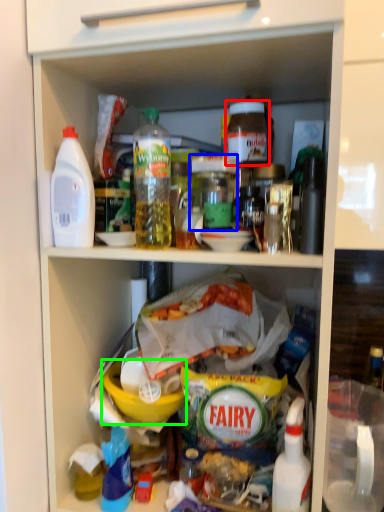
Question: Estimate the real-world distances between objects in this image. Which object is closer to bottle (highlighted by a red box), bottle (highlighted by a blue box) or bowl (highlighted by a green box)?

Choices:
 (A) bottle
 (B) bowl

Answer: (A)